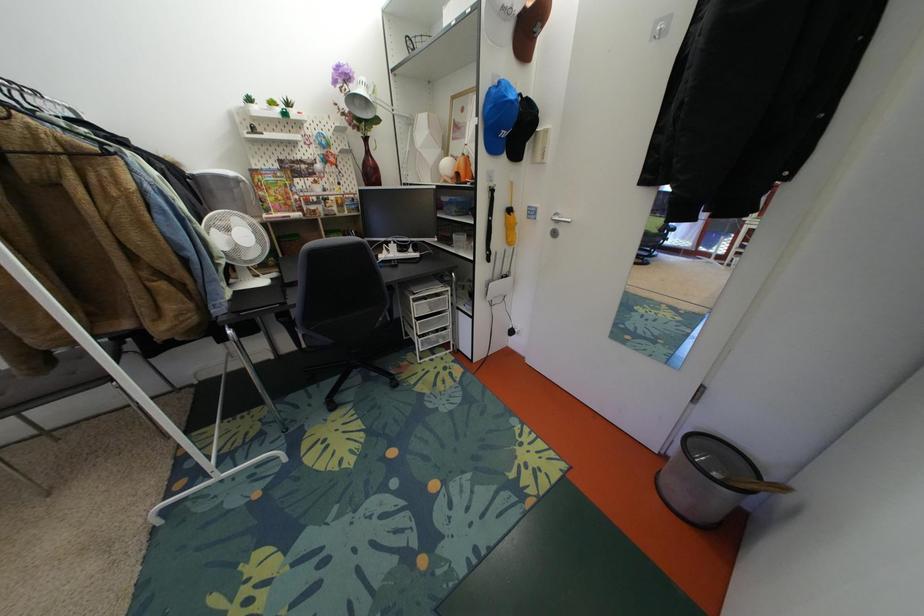
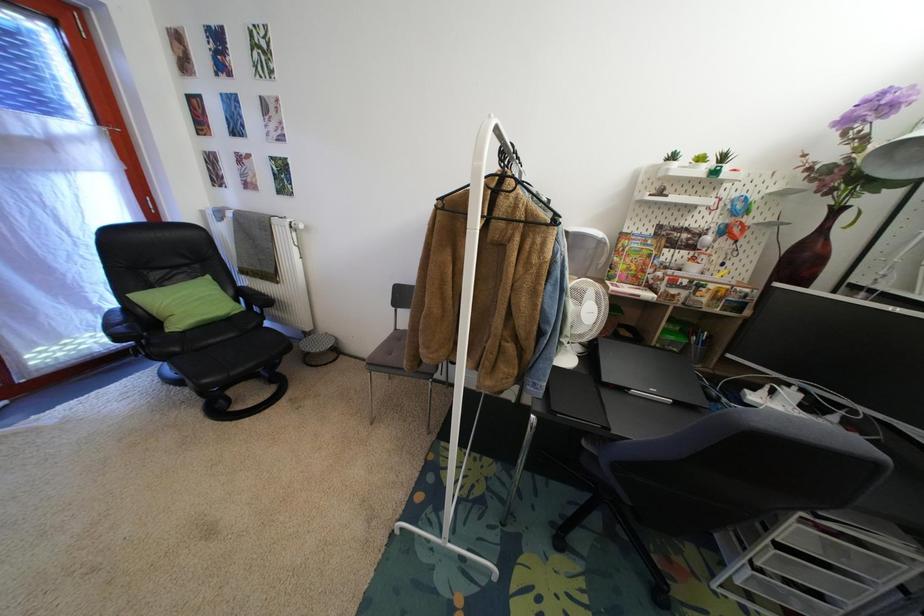
Question: The camera is either moving clockwise (left) or counter-clockwise (right) around the object. The first image is from the beginning of the video and the second image is from the end. Is the camera moving left or right when shooting the video?

Choices:
 (A) Left
 (B) Right

Answer: (B)